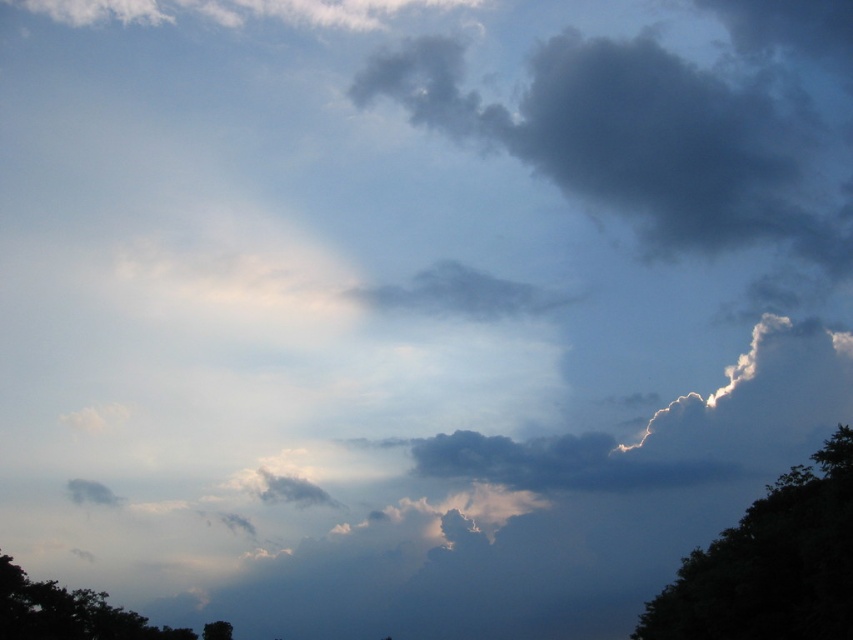
Question: Is dark gray fluffy cloud at upper center smaller than dark green leafy tree at bottom left?

Choices:
 (A) yes
 (B) no

Answer: (B)

Question: Does dark green leafy tree at right appear over dark green leafy tree at bottom left?

Choices:
 (A) yes
 (B) no

Answer: (A)

Question: Can you confirm if dark gray fluffy cloud at upper center is positioned below dark green leafy tree at right?

Choices:
 (A) yes
 (B) no

Answer: (B)

Question: Which of the following is the farthest from the observer?

Choices:
 (A) dark gray fluffy cloud at upper center
 (B) dark green leafy tree at bottom left
 (C) dark green leafy tree at right

Answer: (A)

Question: Which object is the closest to the dark gray fluffy cloud at upper center?

Choices:
 (A) dark green leafy tree at bottom left
 (B) dark green leafy tree at right

Answer: (B)

Question: Which of the following is the closest to the observer?

Choices:
 (A) dark gray fluffy cloud at upper center
 (B) dark green leafy tree at bottom left
 (C) dark green leafy tree at right

Answer: (C)